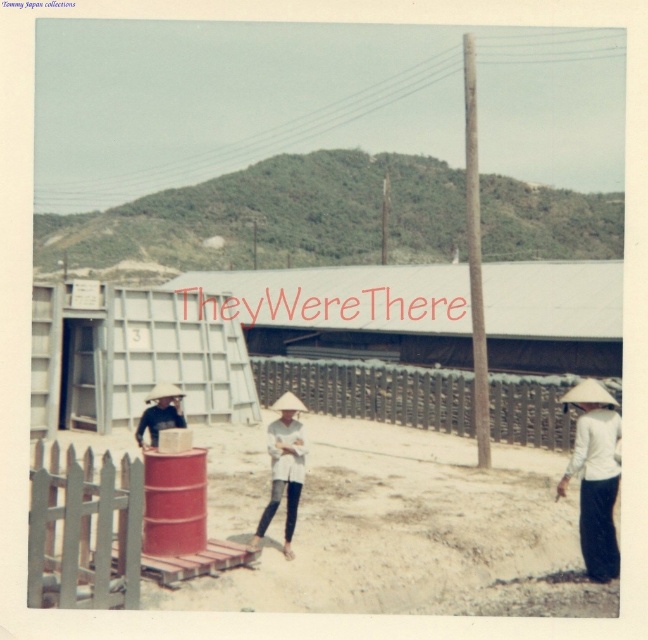
Question: Which of the following is the closest to the observer?

Choices:
 (A) (596, 468)
 (B) (347, 548)
 (C) (281, 424)

Answer: (A)

Question: Among these points, which one is nearest to the camera?

Choices:
 (A) (283, 461)
 (B) (358, 579)

Answer: (B)

Question: Which object is closer to the camera taking this photo?

Choices:
 (A) white matte hat at center
 (B) brown sandy ground at center
 (C) white matte conical hat at lower right

Answer: (B)

Question: Is the position of brown sandy ground at center more distant than that of white matte hat at center?

Choices:
 (A) yes
 (B) no

Answer: (B)

Question: Does brown sandy ground at center lie behind white matte hat at center?

Choices:
 (A) no
 (B) yes

Answer: (A)

Question: Is the position of brown sandy ground at center more distant than that of white matte hat at center?

Choices:
 (A) no
 (B) yes

Answer: (A)